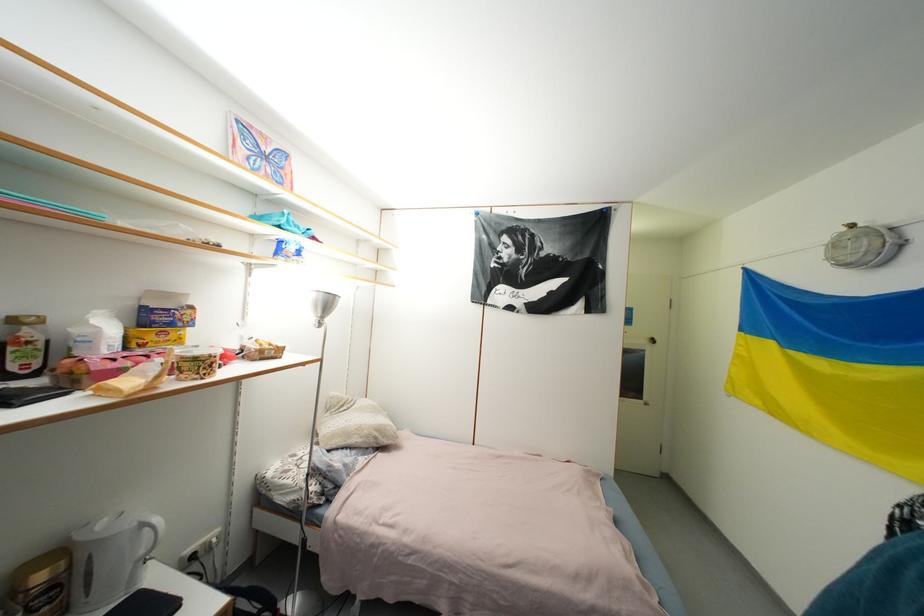
At what (x,y) coordinates should I click in order to perform the action: click on yellow Lipton box. Please return your answer as a coordinate pair (x, y). This screenshot has width=924, height=616. Looking at the image, I should click on (152, 337).